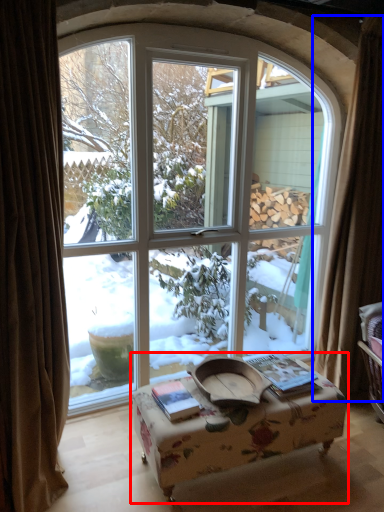
Question: Which object is further to the camera taking this photo, table (highlighted by a red box) or curtain (highlighted by a blue box)?

Choices:
 (A) table
 (B) curtain

Answer: (B)